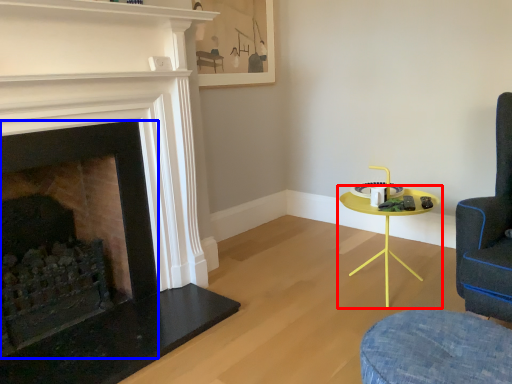
Question: Among these objects, which one is farthest to the camera, table (highlighted by a red box) or fireplace (highlighted by a blue box)?

Choices:
 (A) table
 (B) fireplace

Answer: (A)